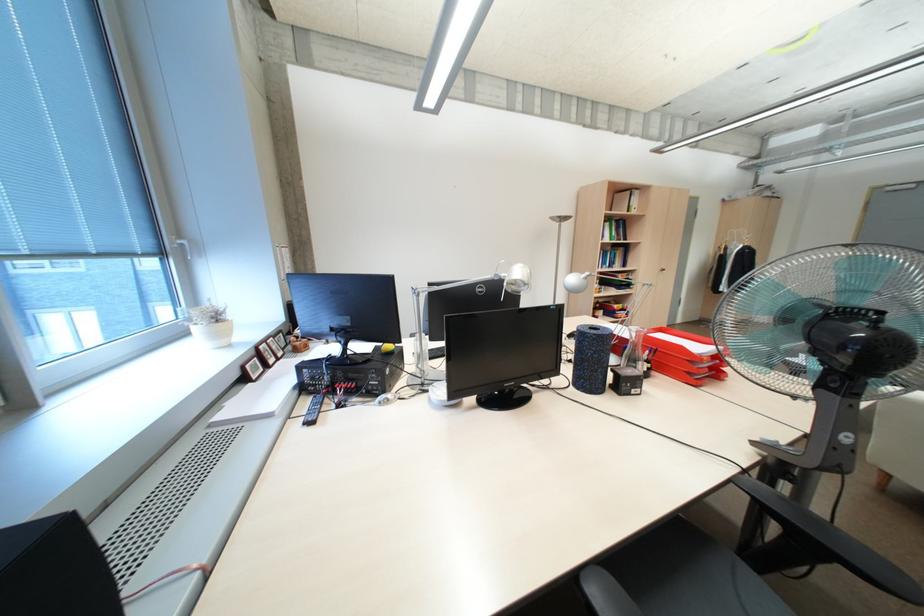
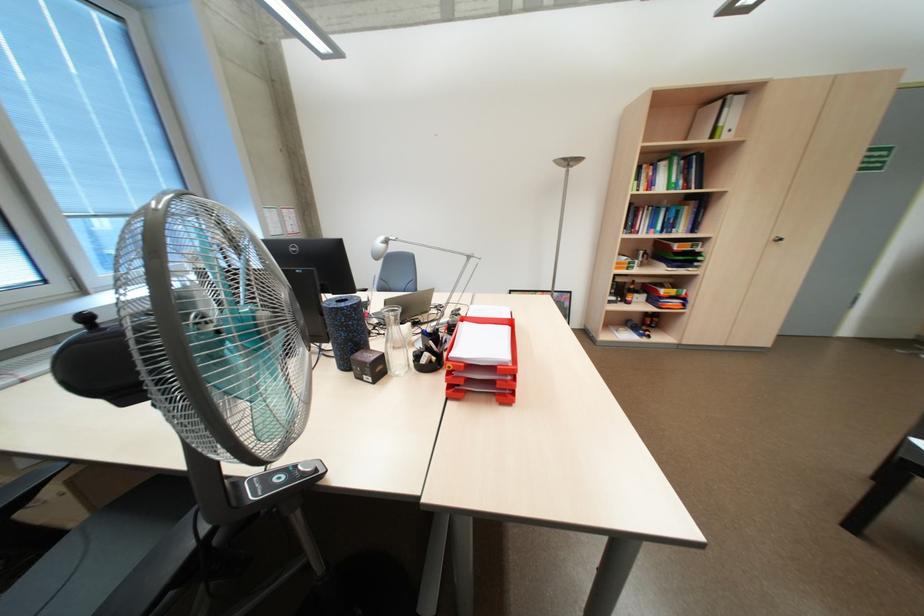
Where in the second image is the point corresponding to pixel 626 195 from the first image?

(711, 110)